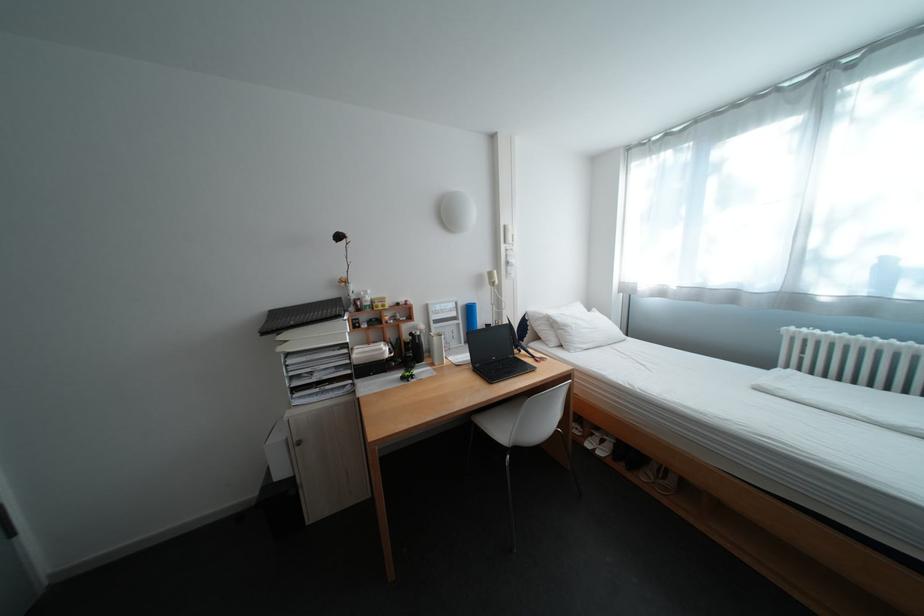
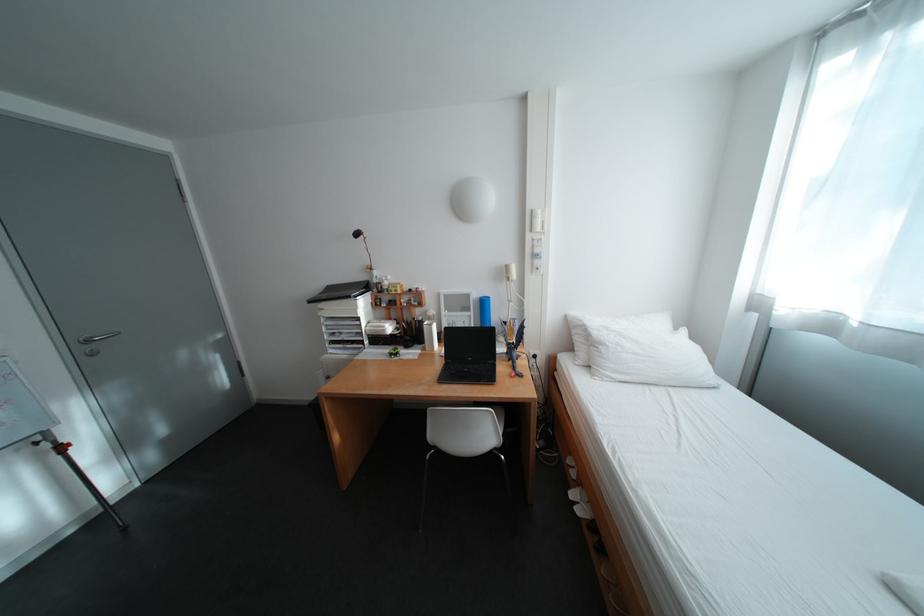
Locate, in the second image, the point that corresponds to (430,342) in the first image.

(430, 326)